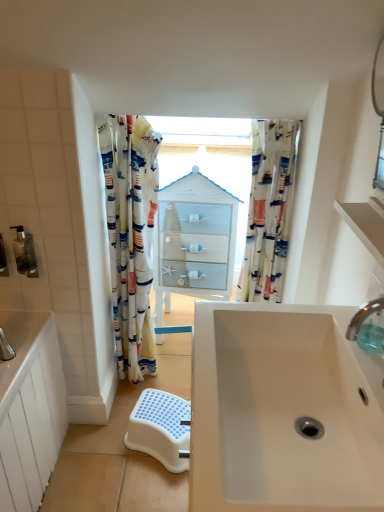
Question: Should I look upward or downward to see clear plastic tap at upper right?

Choices:
 (A) down
 (B) up

Answer: (A)

Question: From a real-world perspective, is clear plastic tap at upper right positioned over translucent plastic soap dispenser at left, marked as the second toiletry in a right-to-left arrangement, based on gravity?

Choices:
 (A) no
 (B) yes

Answer: (B)

Question: Is clear plastic tap at upper right positioned with its back to translucent plastic soap dispenser at left, marked as the second toiletry in a right-to-left arrangement?

Choices:
 (A) no
 (B) yes

Answer: (A)

Question: Does clear plastic tap at upper right turn towards translucent plastic soap dispenser at left, acting as the first toiletry starting from the left?

Choices:
 (A) no
 (B) yes

Answer: (A)

Question: Is clear plastic tap at upper right at the left side of translucent plastic soap dispenser at left, marked as the second toiletry in a right-to-left arrangement?

Choices:
 (A) yes
 (B) no

Answer: (B)

Question: Can you see clear plastic tap at upper right touching translucent plastic soap dispenser at left, acting as the first toiletry starting from the left?

Choices:
 (A) yes
 (B) no

Answer: (B)

Question: Is clear plastic tap at upper right outside translucent plastic soap dispenser at left, acting as the first toiletry starting from the left?

Choices:
 (A) yes
 (B) no

Answer: (A)

Question: From the image's perspective, is white matte sink at center located above clear plastic tap at upper right?

Choices:
 (A) no
 (B) yes

Answer: (A)

Question: Can you confirm if white matte sink at center is smaller than clear plastic tap at upper right?

Choices:
 (A) yes
 (B) no

Answer: (B)

Question: Is white matte sink at center to the right of clear plastic tap at upper right from the viewer's perspective?

Choices:
 (A) no
 (B) yes

Answer: (A)

Question: Can you see white matte sink at center touching clear plastic tap at upper right?

Choices:
 (A) no
 (B) yes

Answer: (A)

Question: Is white matte sink at center to the left of clear plastic tap at upper right from the viewer's perspective?

Choices:
 (A) no
 (B) yes

Answer: (B)

Question: Is white matte sink at center turned away from clear plastic tap at upper right?

Choices:
 (A) no
 (B) yes

Answer: (A)

Question: Is printed fabric curtain at center, marked as the first curtain in a right-to-left arrangement, to the left of white glossy cabinet at center from the viewer's perspective?

Choices:
 (A) no
 (B) yes

Answer: (A)